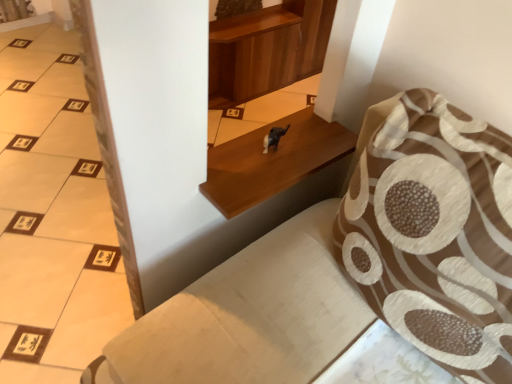
Question: Can you confirm if wooden shelf at center is thinner than brown textured pillow at upper right?

Choices:
 (A) yes
 (B) no

Answer: (A)

Question: Considering the relative sizes of wooden shelf at center and brown textured pillow at upper right in the image provided, is wooden shelf at center taller than brown textured pillow at upper right?

Choices:
 (A) yes
 (B) no

Answer: (B)

Question: Is brown textured pillow at upper right at the back of wooden shelf at center?

Choices:
 (A) no
 (B) yes

Answer: (A)

Question: Is brown textured pillow at upper right located within wooden shelf at center?

Choices:
 (A) yes
 (B) no

Answer: (B)

Question: From the image's perspective, is wooden shelf at center beneath brown textured pillow at upper right?

Choices:
 (A) no
 (B) yes

Answer: (A)

Question: Is wooden shelf at center wider than brown textured pillow at upper right?

Choices:
 (A) yes
 (B) no

Answer: (B)

Question: Considering the relative sizes of shiny black dog at center and brown textured pillow at upper right in the image provided, is shiny black dog at center wider than brown textured pillow at upper right?

Choices:
 (A) no
 (B) yes

Answer: (A)

Question: From a real-world perspective, is shiny black dog at center located beneath brown textured pillow at upper right?

Choices:
 (A) no
 (B) yes

Answer: (B)

Question: Is shiny black dog at center taller than brown textured pillow at upper right?

Choices:
 (A) no
 (B) yes

Answer: (A)

Question: Considering the relative sizes of shiny black dog at center and brown textured pillow at upper right in the image provided, is shiny black dog at center smaller than brown textured pillow at upper right?

Choices:
 (A) yes
 (B) no

Answer: (A)

Question: From the image's perspective, is shiny black dog at center on top of brown textured pillow at upper right?

Choices:
 (A) no
 (B) yes

Answer: (B)

Question: Could you tell me if shiny black dog at center is turned towards brown textured pillow at upper right?

Choices:
 (A) no
 (B) yes

Answer: (B)

Question: Does shiny black dog at center turn towards wooden shelf at center?

Choices:
 (A) no
 (B) yes

Answer: (B)